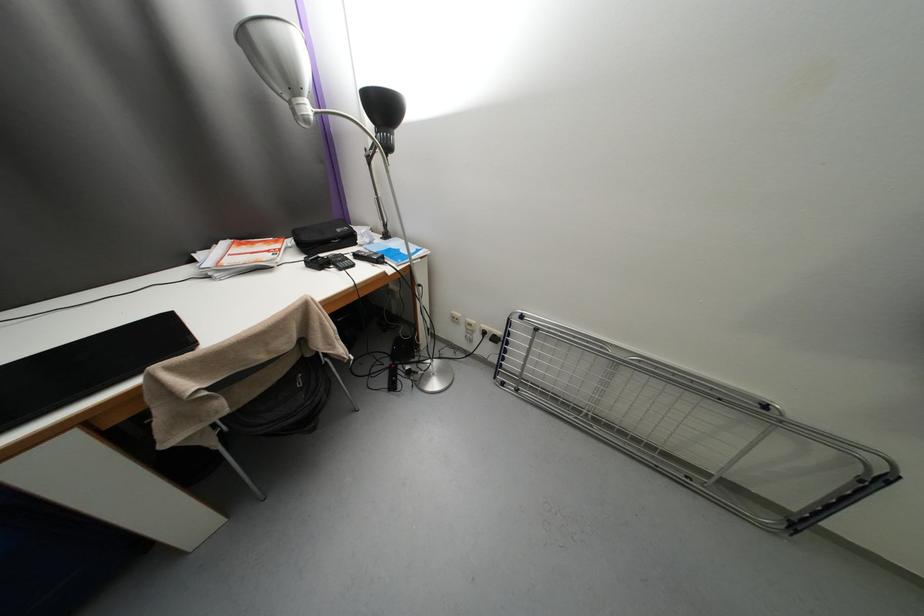
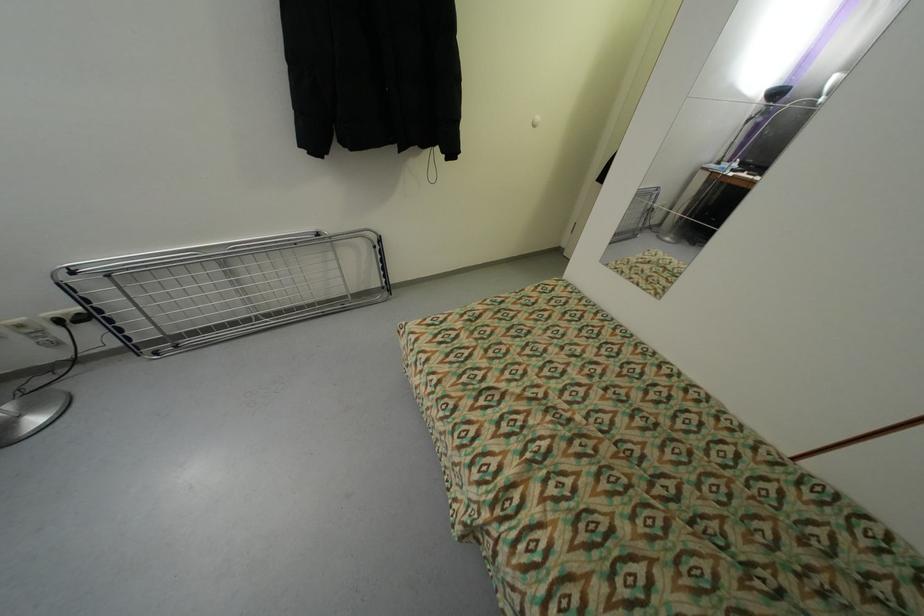
The point at (772,408) is marked in the first image. Where is the corresponding point in the second image?

(323, 236)